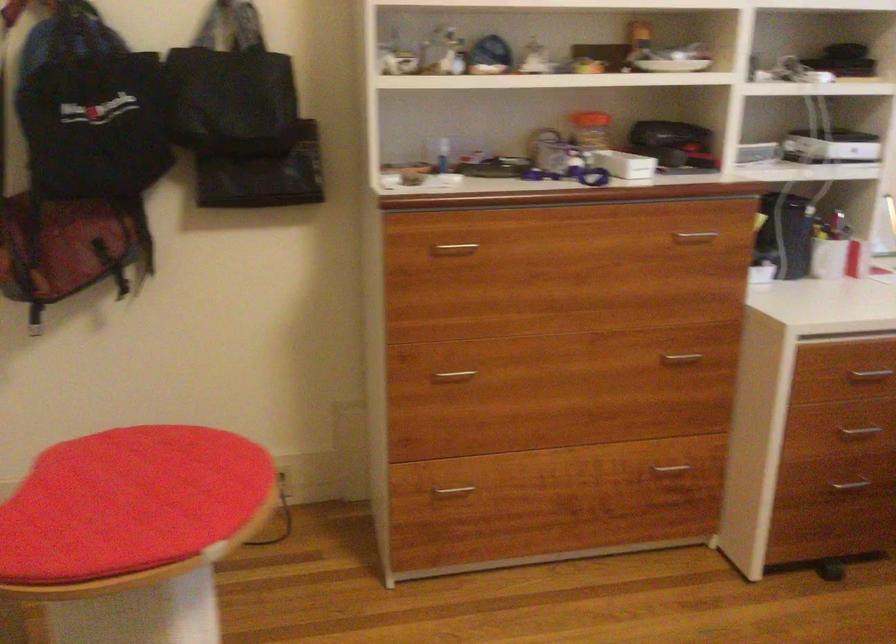
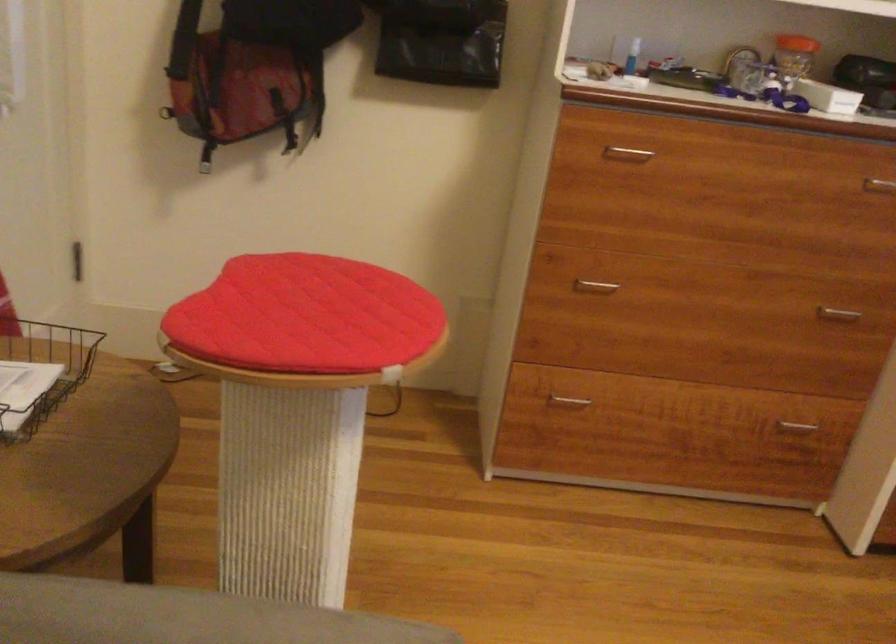
Locate, in the second image, the point that corresponds to the point at 591,126 in the first image.

(794, 53)